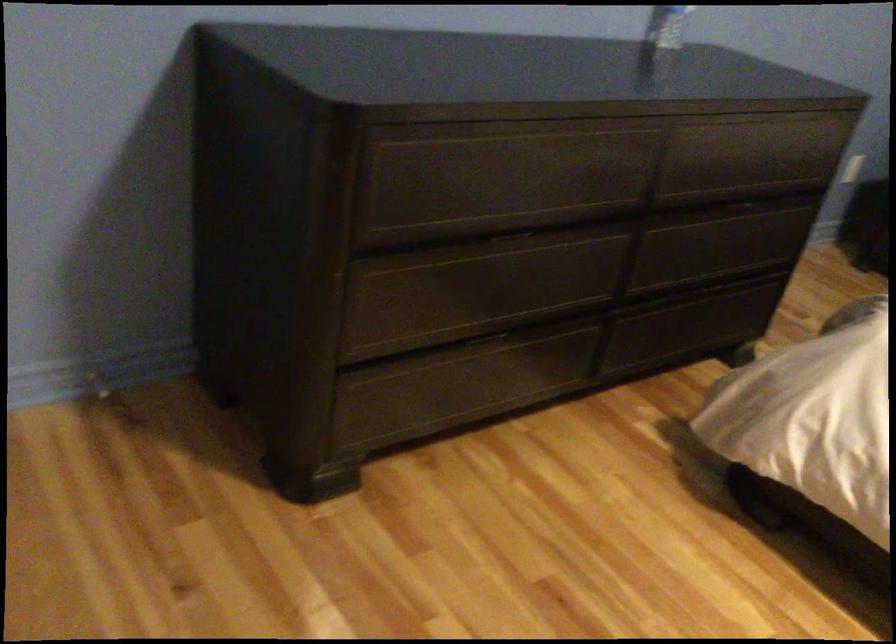
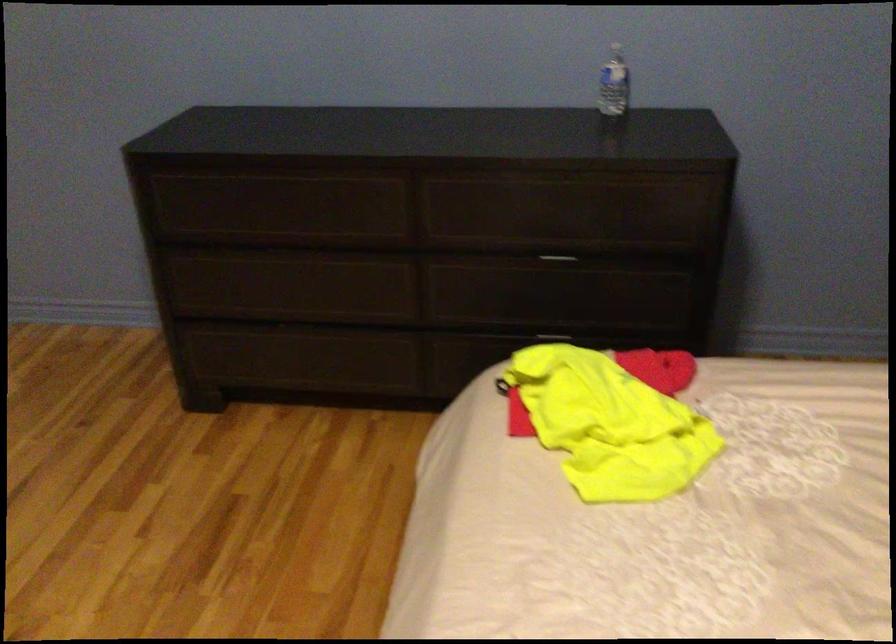
Where in the second image is the point corresponding to (x=719, y=281) from the first image?

(553, 333)